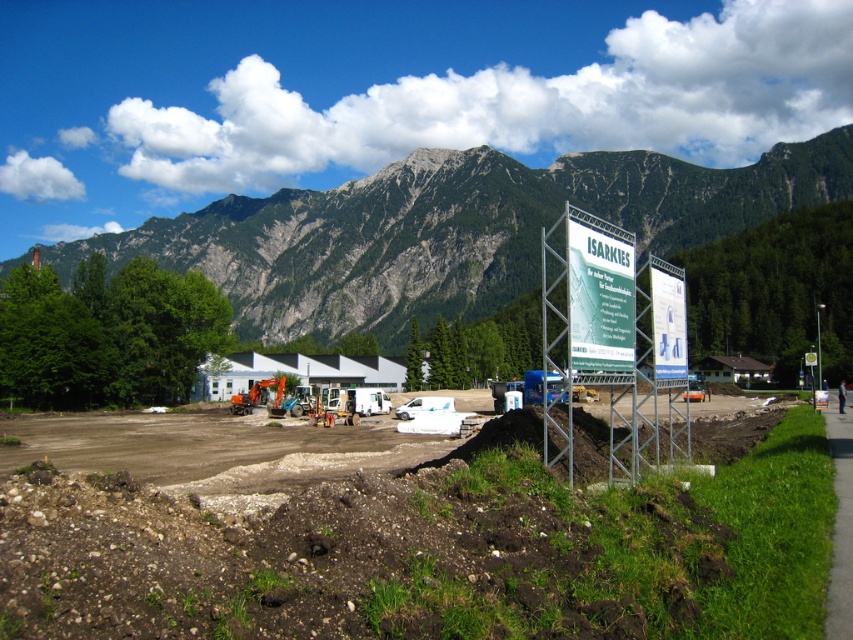
Question: Is rocky gray mountain at upper center to the left of green plastic sign at center from the viewer's perspective?

Choices:
 (A) yes
 (B) no

Answer: (A)

Question: Does brown soil at center have a lesser width compared to rocky gray mountain at upper center?

Choices:
 (A) yes
 (B) no

Answer: (A)

Question: Which point is closer to the camera?

Choices:
 (A) orange metallic construction equipment at center
 (B) rocky gray mountain at upper center
 (C) brown soil at center
 (D) black fabric construction worker at lower right

Answer: (C)

Question: Which object is the closest to the black fabric construction worker at lower right?

Choices:
 (A) orange metallic construction equipment at center
 (B) white plastic sign at center-right

Answer: (B)

Question: Where is brown soil at center located in relation to black fabric construction worker at lower right in the image?

Choices:
 (A) above
 (B) below

Answer: (A)

Question: Which object appears closest to the camera in this image?

Choices:
 (A) white plastic sign at center-right
 (B) rocky gray mountain at upper center

Answer: (A)